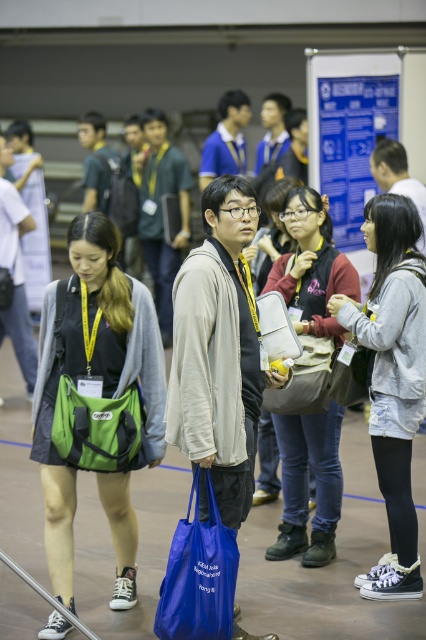
Who is positioned more to the left, green fabric bag at left or green fabric bag at lower left?

green fabric bag at left

Identify the location of green fabric bag at left. Image resolution: width=426 pixels, height=640 pixels. (100, 394).

Which is in front, point (218, 529) or point (322, 400)?

Point (218, 529) is more forward.

The height and width of the screenshot is (640, 426). Find the location of `blue fabric bag at center`. blue fabric bag at center is located at coordinates (198, 576).

Identify the location of blue fabric bag at center. The height and width of the screenshot is (640, 426). (198, 576).

Does green fabric bag at left have a lesser width compared to matte gray backpack at center?

No.

Which is above, green fabric bag at left or matte gray backpack at center?

Positioned higher is matte gray backpack at center.

The image size is (426, 640). Find the location of `green fabric bag at left`. green fabric bag at left is located at coordinates (100, 394).